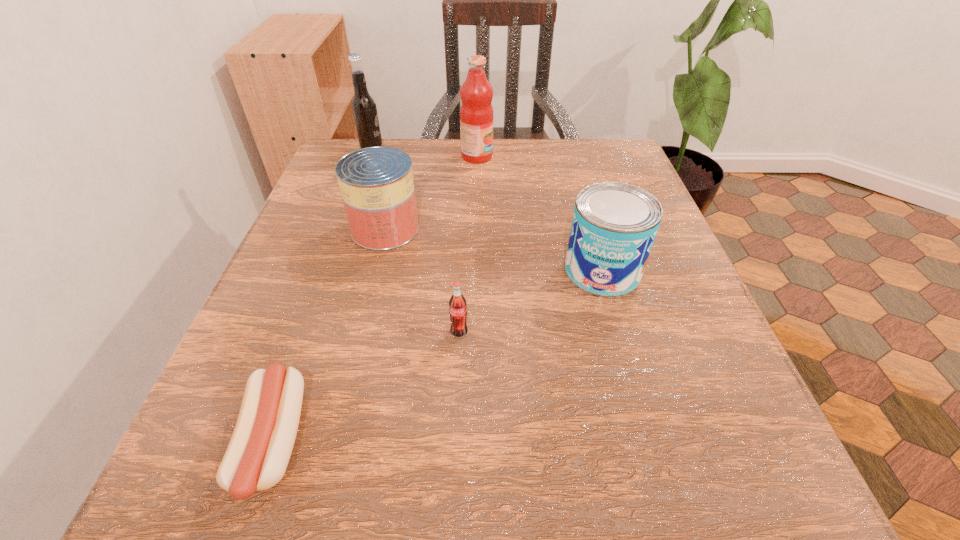
Where is `blank space located on the back of the left can`? blank space located on the back of the left can is located at coordinates (395, 193).

Find the location of a particular element. vacant position located 0.300m on the front of the right can is located at coordinates (664, 485).

The width and height of the screenshot is (960, 540). Find the location of `free space located 0.200m on the label of the fifth tallest object`. free space located 0.200m on the label of the fifth tallest object is located at coordinates (453, 471).

Locate an element on the screen. Image resolution: width=960 pixels, height=540 pixels. free space located 0.350m on the back of the sausage is located at coordinates (348, 228).

I want to click on fruit juice that is at the far edge, so (476, 113).

Locate an element on the screen. This screenshot has width=960, height=540. root beer present at the far edge is located at coordinates (364, 109).

You are a GUI agent. You are given a task and a screenshot of the screen. Output one action in this format:
    pyautogui.click(x=<x>, y=<y>)
    Task: Click on the object situated at the near edge
    The width and height of the screenshot is (960, 540).
    Given the screenshot: What is the action you would take?
    pyautogui.click(x=257, y=456)

The height and width of the screenshot is (540, 960). Identify the location of root beer that is at the left edge. (364, 109).

Find the location of a particular element. can situated at the left edge is located at coordinates (x=376, y=183).

The image size is (960, 540). In order to click on sausage that is at the left edge in this screenshot , I will do `click(257, 456)`.